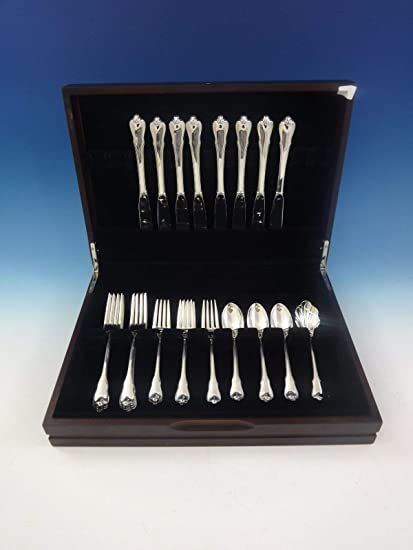
At what (x,y) coordinates should I click in order to perform the action: click on knives. Please return your answer as a coordinate pair (x, y). This screenshot has height=550, width=413. Looking at the image, I should click on (137, 146), (158, 146), (177, 144), (196, 146), (219, 142), (240, 141), (261, 154), (284, 148).